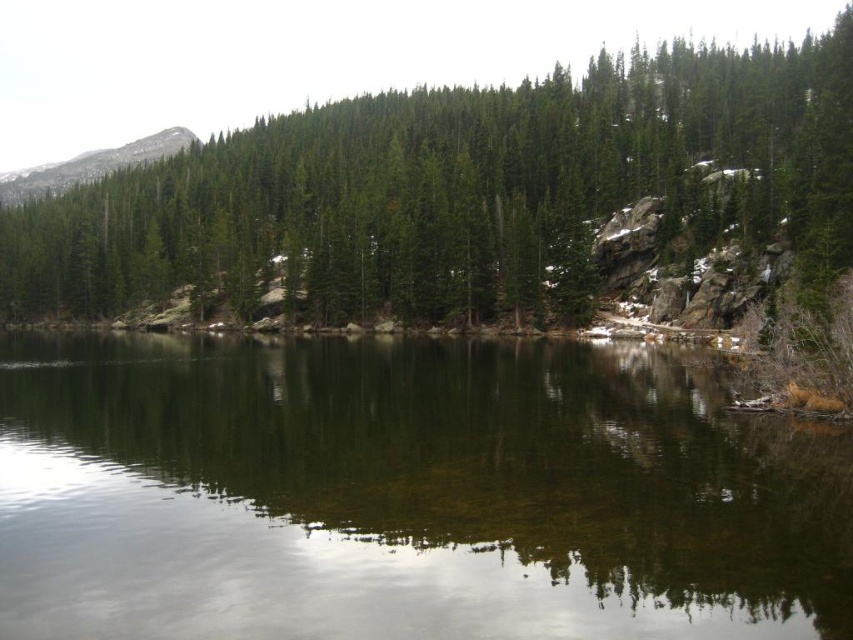
Question: Considering the real-world distances, which object is closest to the green reflective water at center?

Choices:
 (A) gray rocky mountain at upper left
 (B) green matte tree at center

Answer: (B)

Question: Can you confirm if green matte tree at center is wider than gray rocky mountain at upper left?

Choices:
 (A) yes
 (B) no

Answer: (A)

Question: Observing the image, what is the correct spatial positioning of green reflective water at center in reference to gray rocky mountain at upper left?

Choices:
 (A) left
 (B) right

Answer: (B)

Question: Considering the real-world distances, which object is closest to the green reflective water at center?

Choices:
 (A) gray rocky mountain at upper left
 (B) green matte tree at center

Answer: (B)

Question: Is the position of green matte tree at center less distant than that of gray rocky mountain at upper left?

Choices:
 (A) yes
 (B) no

Answer: (A)

Question: Which of the following is the closest to the observer?

Choices:
 (A) (102, 164)
 (B) (318, 452)
 (C) (212, 172)

Answer: (B)